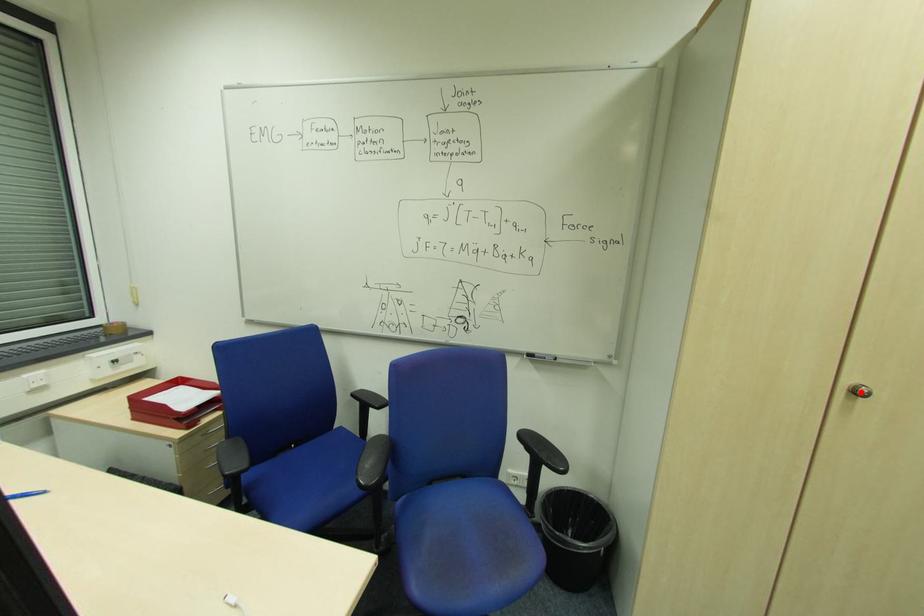
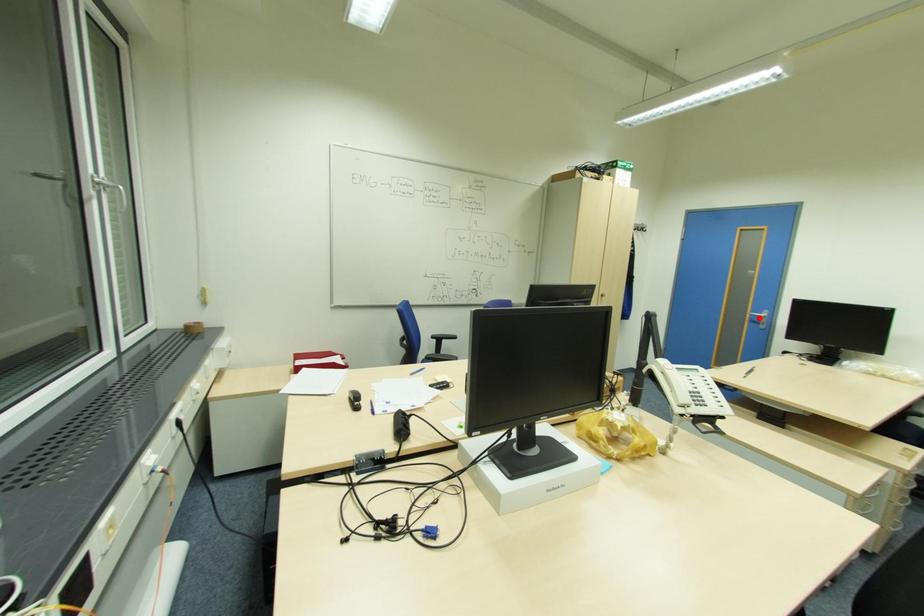
I am providing you with two images of the same scene from different viewpoints. A red point is marked on the first image and another point is marked on the second image. Is the marked point in image1 the same physical position as the marked point in image2?

No